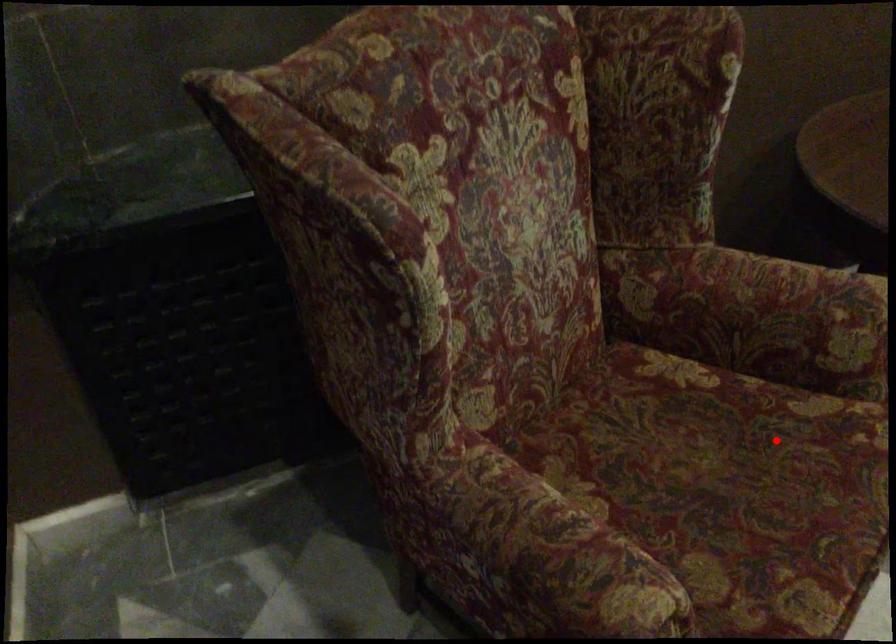
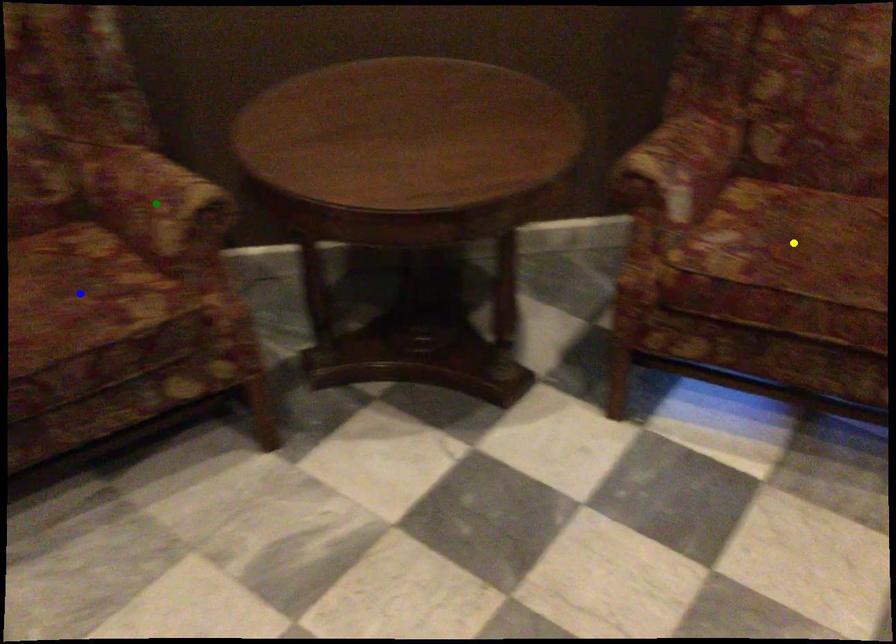
Question: I am providing you with two images of the same scene from different viewpoints. A red point is marked on the first image. You are given multiple points on the second image. Can you choose the point in image 2 that corresponds to the point in image 1?

Choices:
 (A) yellow point
 (B) green point
 (C) blue point

Answer: (C)